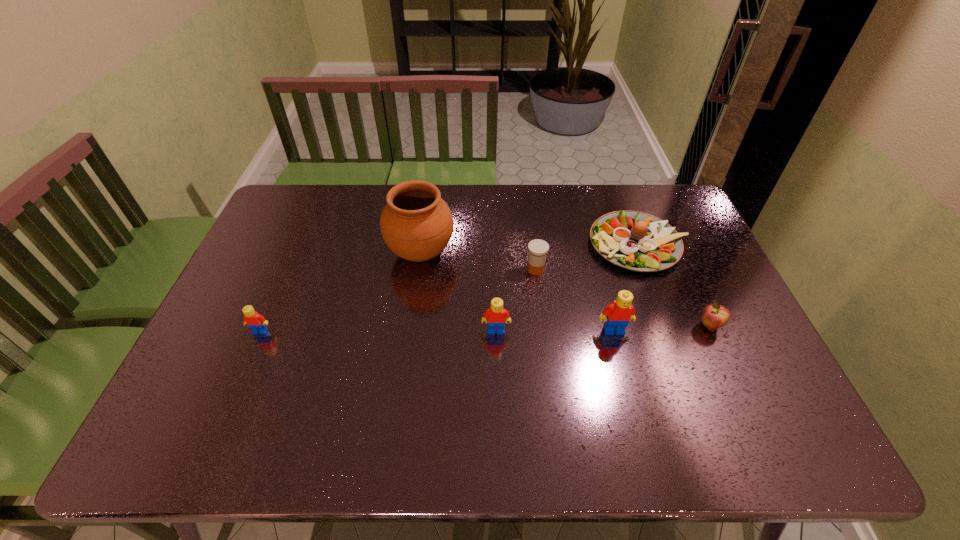
Choose which object is the fifth nearest neighbor to the fourth object from right to left. Please provide its 2D coordinates. Your answer should be formatted as a tuple, i.e. [(x, y)], where the tuple contains the x and y coordinates of a point satisfying the conditions above.

[(714, 316)]

The image size is (960, 540). I want to click on Lego that is the second closest to the salad plate, so click(497, 316).

At what (x,y) coordinates should I click in order to perform the action: click on the closest Lego to the medicine. Please return your answer as a coordinate pair (x, y). This screenshot has width=960, height=540. Looking at the image, I should click on (497, 316).